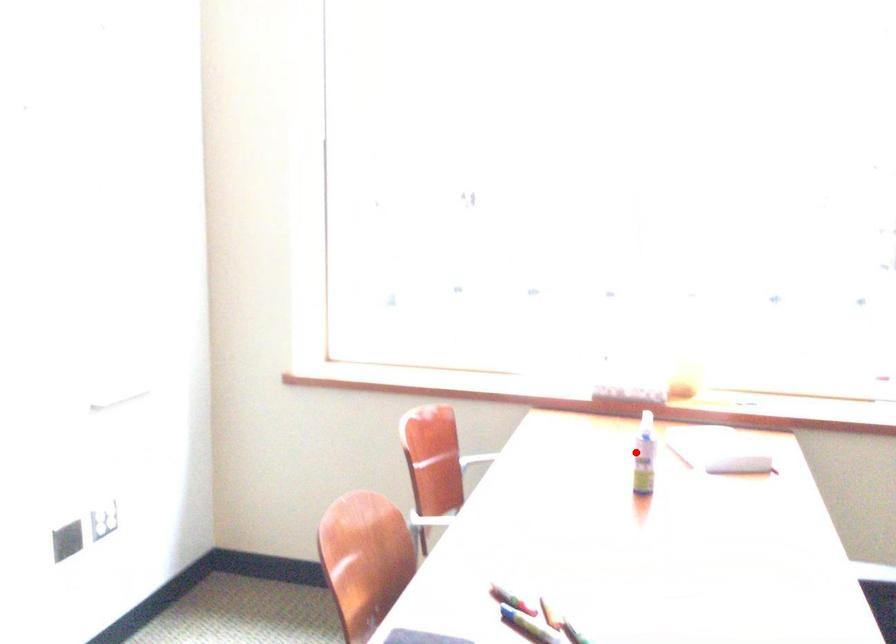
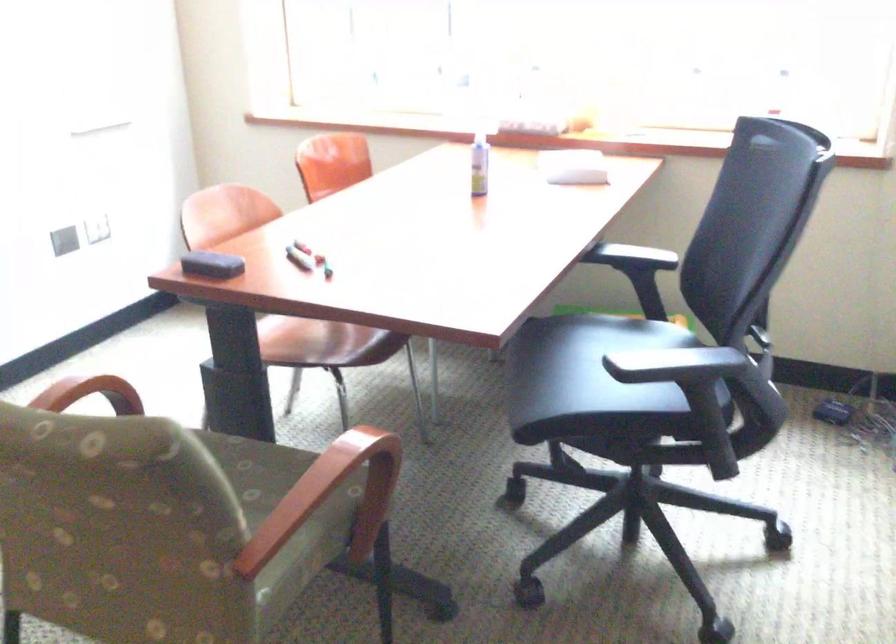
Question: I am providing you with two images of the same scene from different viewpoints. Given a red point in image1, look at the same physical point in image2. Is it:

Choices:
 (A) Closer to the viewpoint
 (B) Farther from the viewpoint

Answer: (B)